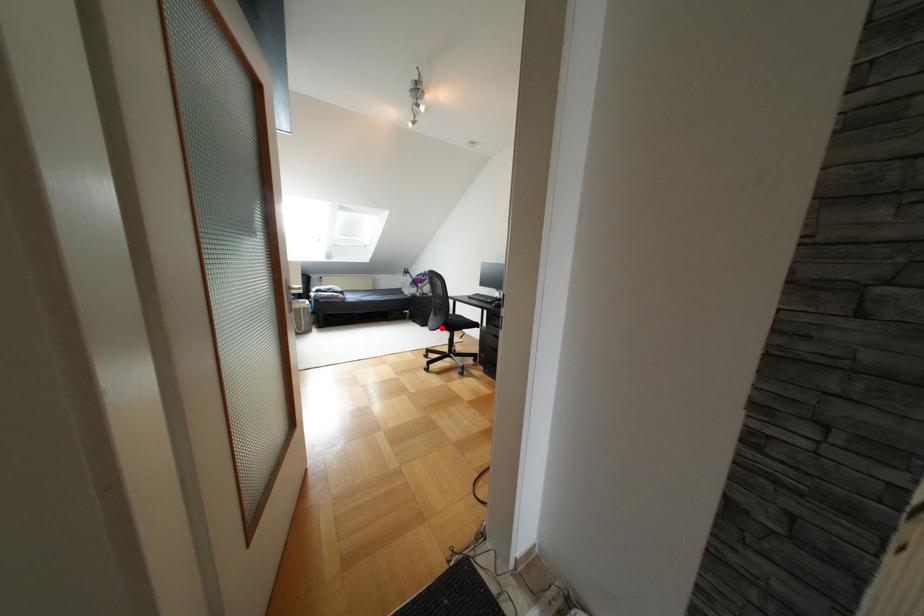
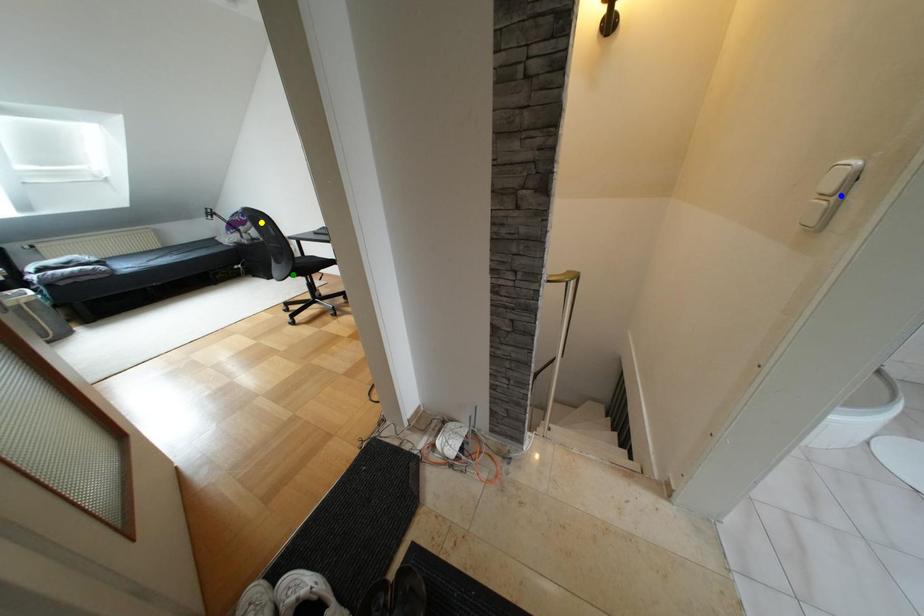
Question: I am providing you with two images of the same scene from different viewpoints. A red point is marked on the first image. You are given multiple points on the second image. Can you choose the point in image 2 that corresponds to the point in image 1?

Choices:
 (A) yellow point
 (B) blue point
 (C) green point

Answer: (C)